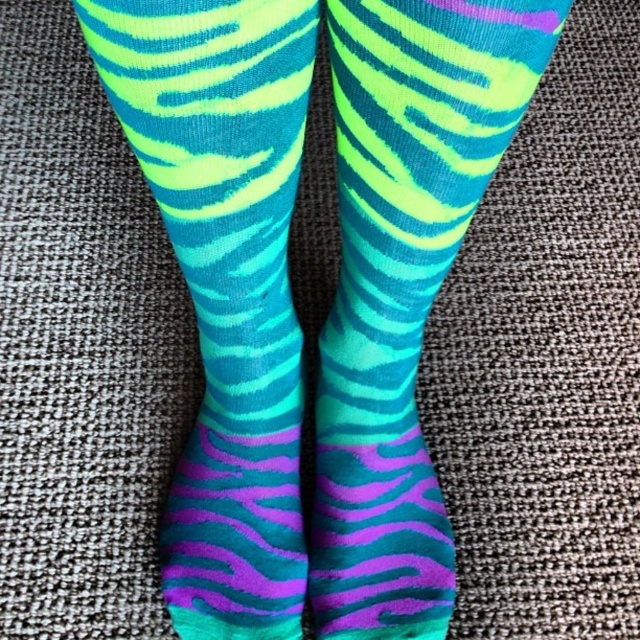
From the picture: You are designing a sock display in a store. You have two neon green fabric socks at left and neon green fabric socks at center. Which sock should you place in the center of the display to ensure it looks proportional with the other socks around it?

The neon green fabric socks at center should be placed in the center of the display because it is smaller in size compared to the neon green fabric socks at left, ensuring proportionality with the other socks around it.

You are designing a sock display stand and need to place two neon green fabric socks at left and neon green fabric socks at center. The display requires a minimum of 10 centimeters between items. Can the current spacing between them meet the requirement?

The neon green fabric socks at left and neon green fabric socks at center are 11.23 centimeters apart from each other, which exceeds the minimum requirement of 10 centimeters. Therefore, the current spacing between them meets the requirement.

You are trying to match a pair of socks for a costume party. You have two neon green fabric socks at left and neon green fabric socks at center. Which pair should you choose if you want the shorter ones?

The neon green fabric socks at left are shorter in height compared to the neon green fabric socks at center, so you should choose the neon green fabric socks at left for the shorter pair.